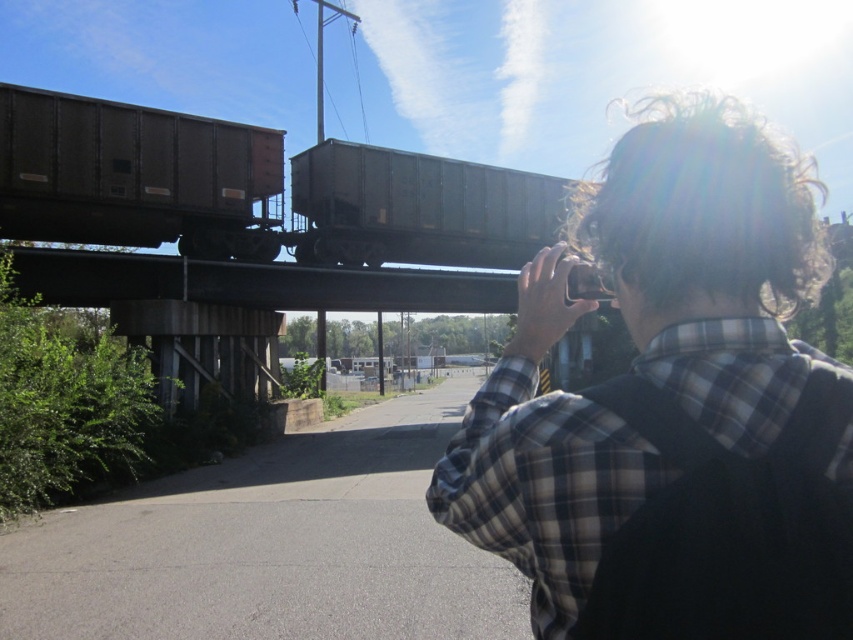
You are a photographer standing on the paved road and see the plaid shirt at upper right and the brown matte train car at left. Which object is closer to the ground?

The plaid shirt at upper right is located below brown matte train car at left, so the plaid shirt at upper right is closer to the ground.

Looking at this image, based on the scene described, where is the plaid shirt at upper right located in terms of its 2D coordinates?

The plaid shirt at upper right is located at the 2D coordinates of point (711, 260).

You are a photographer standing on the paved road and see the plaid shirt at upper right and the dark gray metal train car at upper center. Which object is located to the right of the other?

The plaid shirt at upper right is positioned on the right side of dark gray metal train car at upper center.